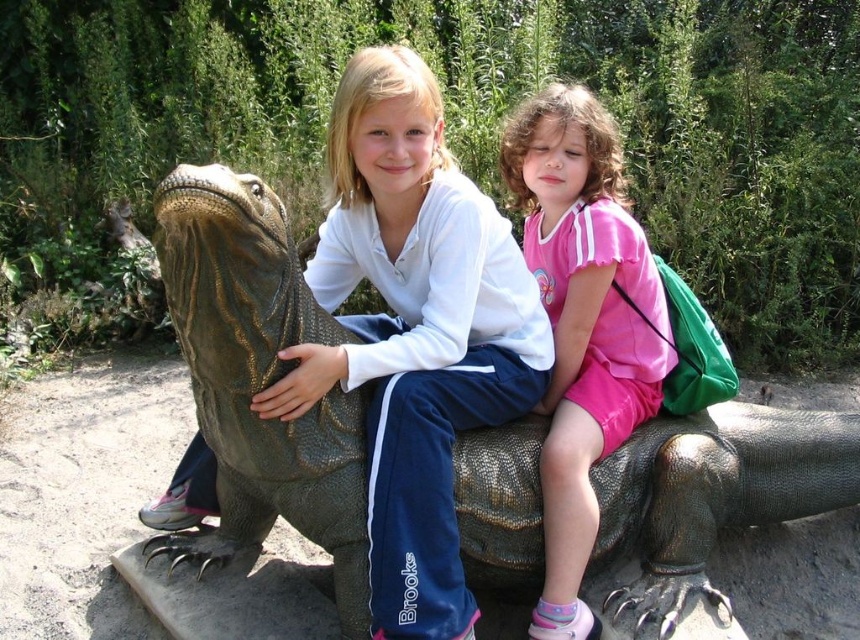
Is point (833, 481) positioned behind point (560, 540)?

Yes, point (833, 481) is farther from viewer.

Who is more forward, (250, 385) or (628, 429)?

Point (250, 385)

Where is `shiny green scales at center`? The image size is (860, 640). shiny green scales at center is located at coordinates (262, 371).

Is matte green lizard at center taller than pink shiny shorts at lower right?

In fact, matte green lizard at center may be shorter than pink shiny shorts at lower right.

Between matte green lizard at center and pink shiny shorts at lower right, which one is positioned lower?

pink shiny shorts at lower right

Describe the element at coordinates (415, 332) in the screenshot. Image resolution: width=860 pixels, height=640 pixels. I see `matte green lizard at center` at that location.

This screenshot has height=640, width=860. I want to click on matte green lizard at center, so click(415, 332).

Which is in front, point (192, 548) or point (378, 237)?

Point (378, 237)

Between shiny green scales at center and matte green lizard at center, which one appears on the left side from the viewer's perspective?

Positioned to the left is shiny green scales at center.

Is point (498, 541) positioned after point (445, 280)?

That is True.

Find the location of `shiny green scales at center`. shiny green scales at center is located at coordinates (262, 371).